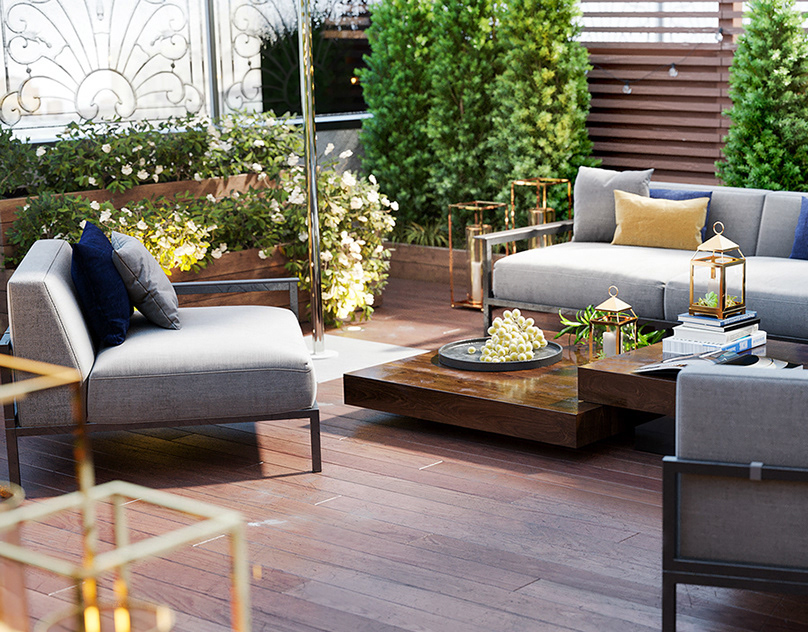
At what (x,y) coordinates should I click in order to perform the action: click on plants small. Please return your answer as a coordinate pair (x, y). The image size is (808, 632). Looking at the image, I should click on (358, 240), (198, 243), (95, 232), (254, 145), (141, 162), (36, 165).